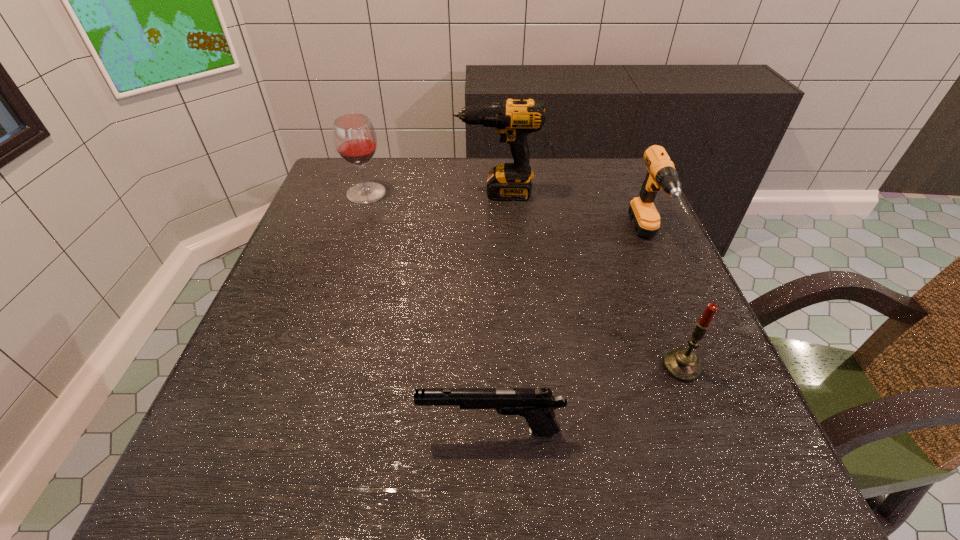
Find the location of a particular element. This screenshot has width=960, height=540. vacant space that's between the third nearest object and the second shortest object is located at coordinates (664, 303).

The image size is (960, 540). What are the coordinates of `empty space that is in between the wineglass and the candle` in the screenshot? It's located at (524, 280).

Where is `vacant area that lies between the leftmost object and the nearer drill`? The height and width of the screenshot is (540, 960). vacant area that lies between the leftmost object and the nearer drill is located at coordinates (507, 217).

Locate an element on the screen. The image size is (960, 540). free area in between the leftmost object and the nearest object is located at coordinates (428, 312).

Locate an element on the screen. free space that is in between the candle and the wineglass is located at coordinates (524, 280).

The image size is (960, 540). Identify the location of unoccupied position between the nearest object and the fourth tallest object. (586, 399).

Locate an element on the screen. This screenshot has width=960, height=540. free space between the candle and the nearer drill is located at coordinates (664, 303).

The width and height of the screenshot is (960, 540). Find the location of `empty location between the gun and the fourth farthest object`. empty location between the gun and the fourth farthest object is located at coordinates (586, 399).

In order to click on free space that is in between the left drill and the third nearest object in this screenshot , I will do (x=572, y=217).

Find the location of a particular element. free space between the nearer drill and the left drill is located at coordinates (572, 217).